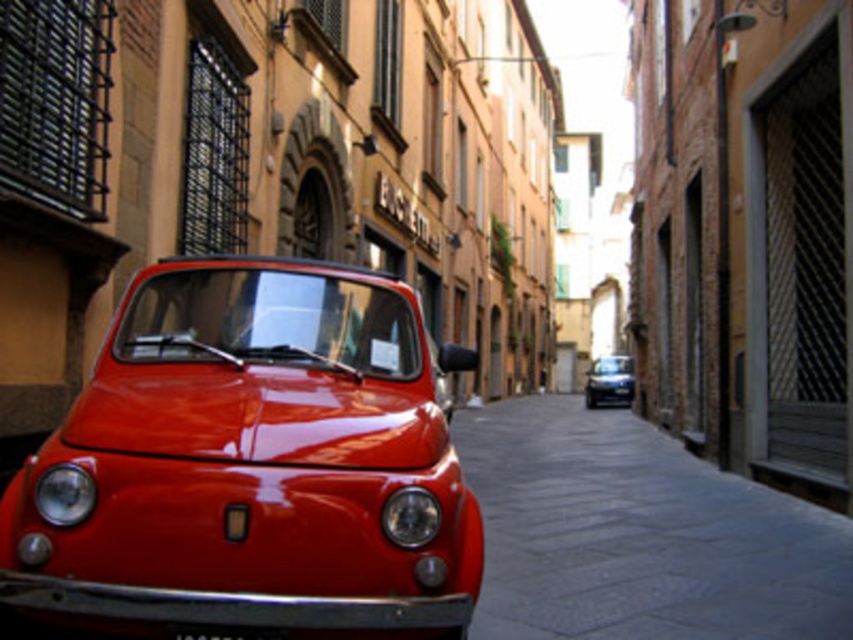
Question: Which object appears farthest from the camera in this image?

Choices:
 (A) black plastic license plate at center
 (B) dark gray stone alley at center
 (C) glossy red car at center

Answer: (B)

Question: Does glossy red car at center appear on the right side of black plastic license plate at center?

Choices:
 (A) no
 (B) yes

Answer: (A)

Question: Is glossy red car at center to the right of dark gray stone alley at center from the viewer's perspective?

Choices:
 (A) no
 (B) yes

Answer: (A)

Question: Among these objects, which one is farthest from the camera?

Choices:
 (A) glossy red car at center
 (B) black plastic license plate at center
 (C) dark gray stone alley at center
 (D) shiny black car at center

Answer: (D)

Question: Among these objects, which one is farthest from the camera?

Choices:
 (A) shiny black car at center
 (B) dark gray stone alley at center
 (C) glossy red car at center

Answer: (A)

Question: Does dark gray stone alley at center have a greater width compared to shiny black car at center?

Choices:
 (A) yes
 (B) no

Answer: (B)